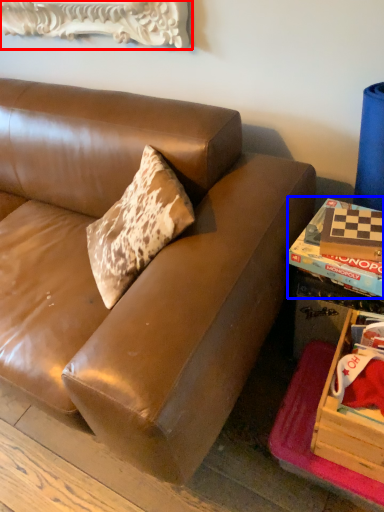
Question: Which point is further to the camera, picture frame (highlighted by a red box) or book (highlighted by a blue box)?

Choices:
 (A) picture frame
 (B) book

Answer: (A)